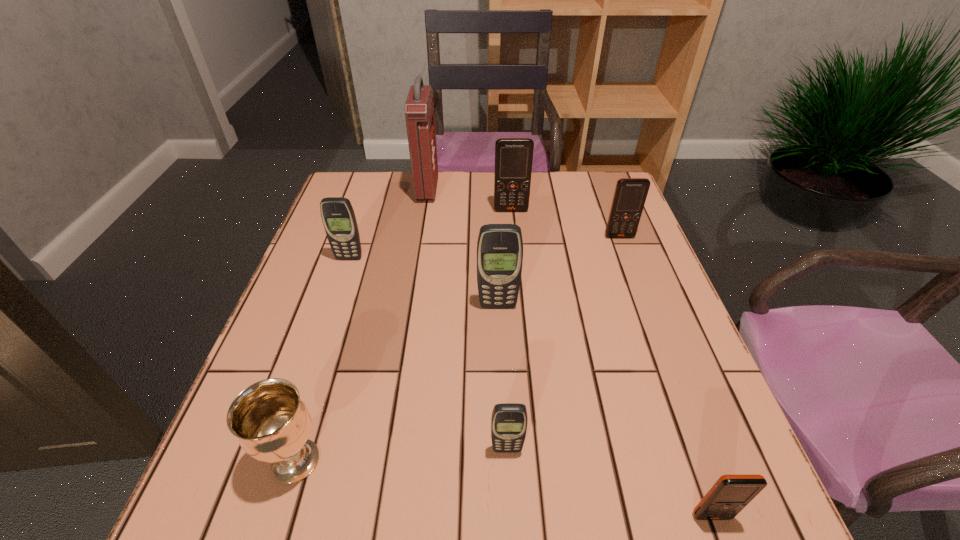
The height and width of the screenshot is (540, 960). Identify the location of chalice. (272, 423).

Where is `the nearest cellular telephone`? the nearest cellular telephone is located at coordinates (730, 494).

Image resolution: width=960 pixels, height=540 pixels. What are the coordinates of `the nearest orange cellular telephone` in the screenshot? It's located at (730, 494).

Identify the location of the nearest gray cellular telephone. (509, 421).

Where is `the smallest gray cellular telephone`? The image size is (960, 540). the smallest gray cellular telephone is located at coordinates (509, 421).

Identify the location of free region located 0.390m on the front-facing side of the farthest object. The height and width of the screenshot is (540, 960). click(562, 190).

Where is `free spot located 0.100m on the screen of the farthest orange cellular telephone`? Image resolution: width=960 pixels, height=540 pixels. free spot located 0.100m on the screen of the farthest orange cellular telephone is located at coordinates (514, 234).

Locate an element on the screen. free spot located 0.380m on the screen of the biggest gray cellular telephone is located at coordinates (505, 478).

You are a GUI agent. You are given a task and a screenshot of the screen. Output one action in this format:
    pyautogui.click(x=<x>, y=<y>)
    Task: Click on the free point located 0.370m on the screen of the fourth nearest cellular telephone
    
    Given the screenshot: What is the action you would take?
    pyautogui.click(x=307, y=385)

Identify the location of vacant space located 0.130m on the screen of the fifth nearest cellular telephone. Image resolution: width=960 pixels, height=540 pixels. (633, 272).